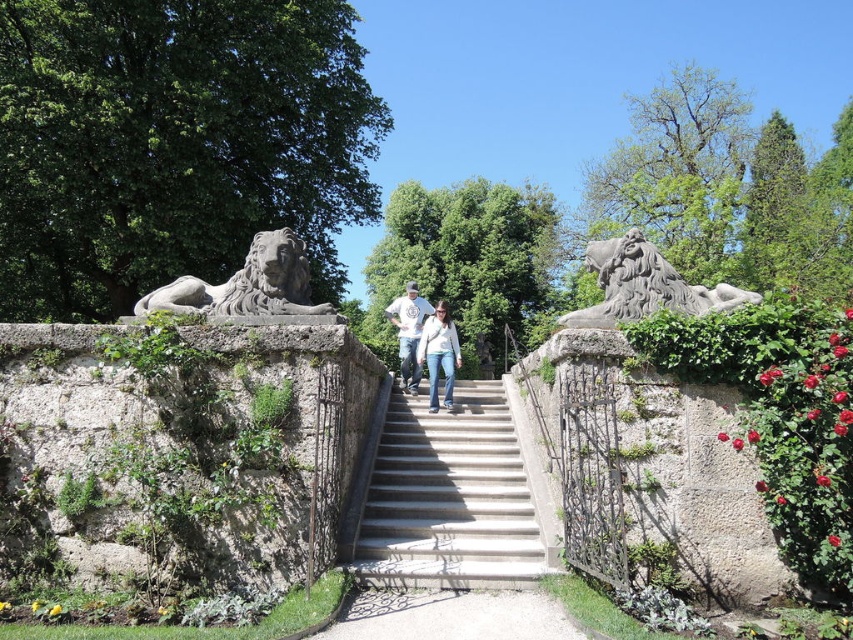
This screenshot has height=640, width=853. What do you see at coordinates (643, 285) in the screenshot?
I see `gray stone lion at upper right` at bounding box center [643, 285].

Between gray stone lion at upper right and white cotton shirt at center, which one has more height?

white cotton shirt at center is taller.

This screenshot has height=640, width=853. Identify the location of gray stone lion at upper right. (643, 285).

Which is below, gray stone lion at left or white cotton shirt at center?

white cotton shirt at center

Who is shorter, gray stone lion at left or white cotton shirt at center?

gray stone lion at left

Between point (268, 289) and point (415, 353), which one is positioned in front?

Point (268, 289) is more forward.

Where is `gray stone lion at left`? This screenshot has height=640, width=853. gray stone lion at left is located at coordinates (247, 284).

Between gray stone lion at upper right and denim jeans at center, which one appears on the right side from the viewer's perspective?

From the viewer's perspective, gray stone lion at upper right appears more on the right side.

Locate an element on the screen. Image resolution: width=853 pixels, height=640 pixels. gray stone lion at upper right is located at coordinates (643, 285).

This screenshot has height=640, width=853. I want to click on gray stone lion at upper right, so click(643, 285).